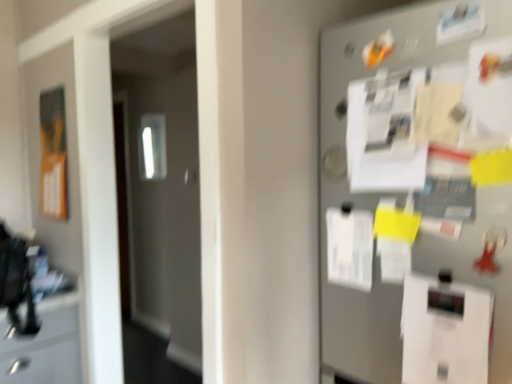
Question: From the image's perspective, is orange matte poster at left located beneath white paper at center, placed as the 1th paper when sorted from top to bottom?

Choices:
 (A) no
 (B) yes

Answer: (A)

Question: From the image's perspective, is orange matte poster at left on top of white paper at center, arranged as the second paper when viewed from the right?

Choices:
 (A) yes
 (B) no

Answer: (A)

Question: Are orange matte poster at left and white paper at center, placed as the 2th paper when sorted from front to back, beside each other?

Choices:
 (A) no
 (B) yes

Answer: (A)

Question: Does orange matte poster at left contain white paper at center, the 1th paper positioned from the back?

Choices:
 (A) no
 (B) yes

Answer: (A)

Question: Can you confirm if orange matte poster at left is smaller than white paper at center, the 1th paper positioned from the back?

Choices:
 (A) yes
 (B) no

Answer: (B)

Question: Considering their positions, is white paper at center, placed as the second paper when sorted from back to front, located in front of or behind transparent glass door at left?

Choices:
 (A) behind
 (B) front

Answer: (B)

Question: Considering the positions of white paper at center, marked as the first paper in a front-to-back arrangement, and transparent glass door at left in the image, is white paper at center, marked as the first paper in a front-to-back arrangement, bigger or smaller than transparent glass door at left?

Choices:
 (A) big
 (B) small

Answer: (B)

Question: From the image's perspective, is white paper at center, placed as the 1th paper when sorted from bottom to top, located above or below transparent glass door at left?

Choices:
 (A) above
 (B) below

Answer: (B)

Question: Considering the relative positions of white paper at center, marked as the second paper in a left-to-right arrangement, and transparent glass door at left in the image provided, is white paper at center, marked as the second paper in a left-to-right arrangement, to the left or to the right of transparent glass door at left?

Choices:
 (A) right
 (B) left

Answer: (A)

Question: In terms of width, does metallic gray fridge at right look wider or thinner when compared to transparent glass door at left?

Choices:
 (A) thin
 (B) wide

Answer: (A)

Question: From their relative heights in the image, would you say metallic gray fridge at right is taller or shorter than transparent glass door at left?

Choices:
 (A) short
 (B) tall

Answer: (A)

Question: Considering the positions of metallic gray fridge at right and transparent glass door at left in the image, is metallic gray fridge at right bigger or smaller than transparent glass door at left?

Choices:
 (A) big
 (B) small

Answer: (B)

Question: Is metallic gray fridge at right inside or outside of transparent glass door at left?

Choices:
 (A) inside
 (B) outside

Answer: (B)

Question: Looking at their shapes, would you say orange matte poster at left is wider or thinner than white paper at center, marked as the first paper in a front-to-back arrangement?

Choices:
 (A) wide
 (B) thin

Answer: (A)

Question: From a real-world perspective, relative to white paper at center, which ranks as the 1th paper in right-to-left order, is orange matte poster at left vertically above or below?

Choices:
 (A) above
 (B) below

Answer: (A)